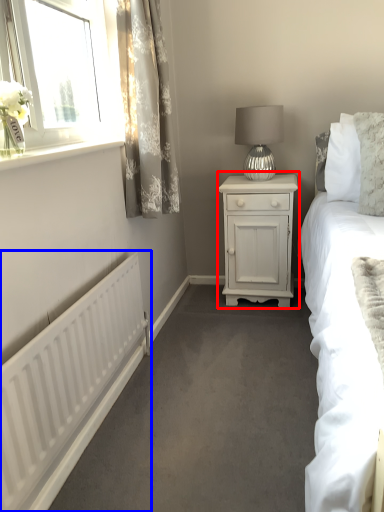
Question: Which point is closer to the camera, nightstand (highlighted by a red box) or radiator (highlighted by a blue box)?

Choices:
 (A) nightstand
 (B) radiator

Answer: (B)